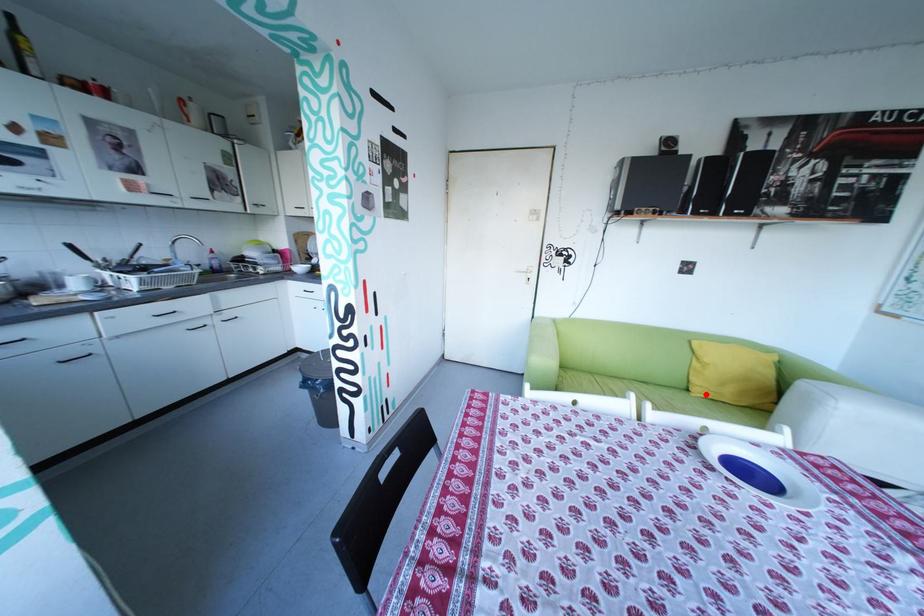
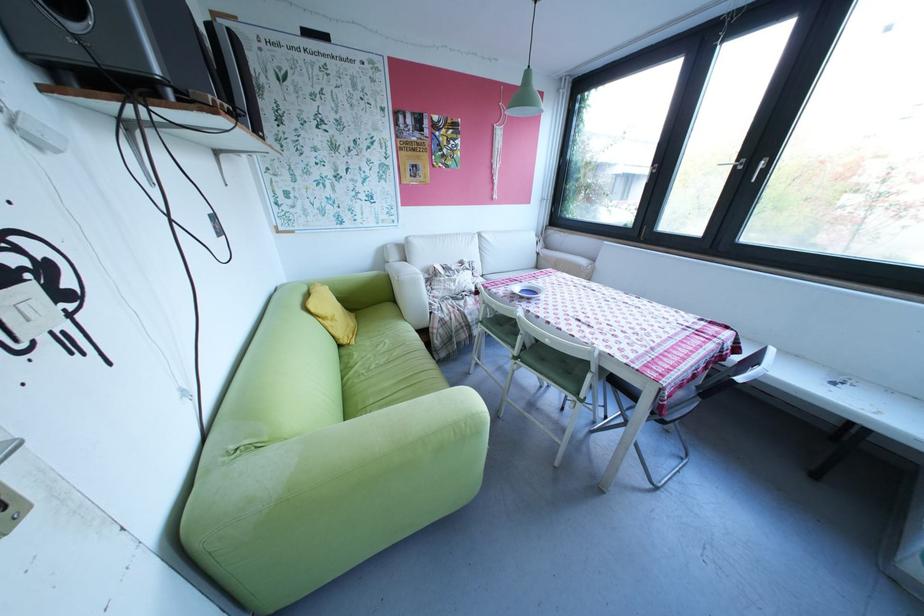
Locate, in the second image, the point that corresponds to the highlighted location in the first image.

(366, 342)